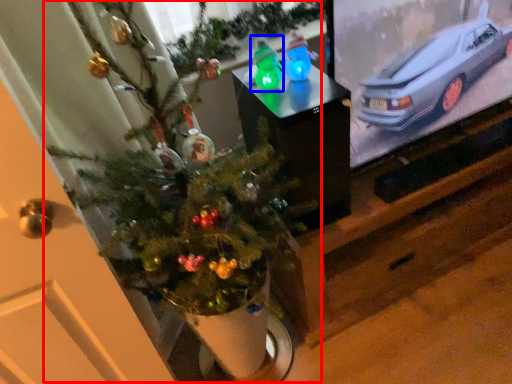
Question: Which of the following is the farthest to the observer, christmas tree (highlighted by a red box) or toy (highlighted by a blue box)?

Choices:
 (A) christmas tree
 (B) toy

Answer: (B)